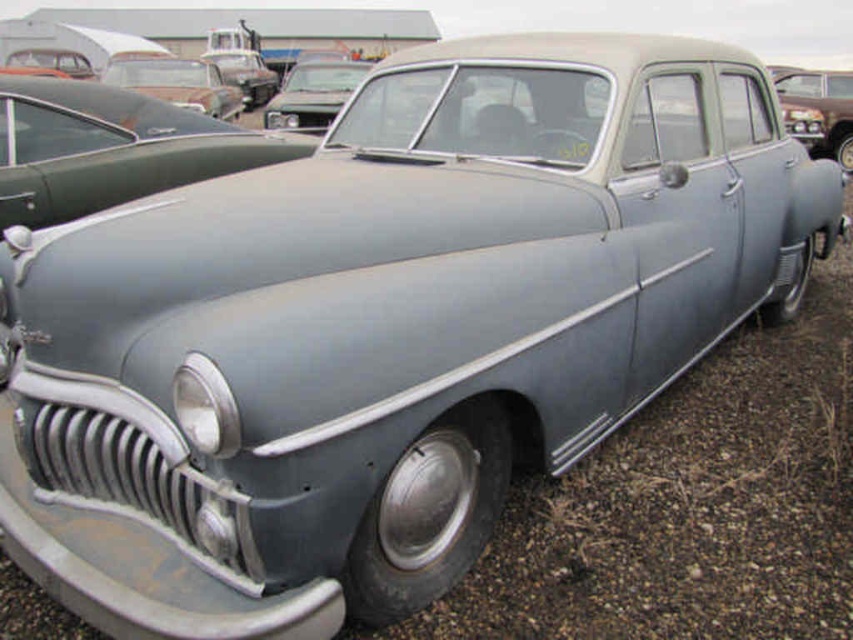
Who is taller, matte gray car at center or rusty metal car at upper left?

rusty metal car at upper left

Is matte gray car at center wider than rusty metal car at upper left?

No.

The width and height of the screenshot is (853, 640). Describe the element at coordinates (109, 147) in the screenshot. I see `matte gray car at center` at that location.

Find the location of a particular element. The height and width of the screenshot is (640, 853). matte gray car at center is located at coordinates (109, 147).

Is matte gray car at center above matte gray car at upper right?

Actually, matte gray car at center is below matte gray car at upper right.

Does matte gray car at center have a greater width compared to matte gray car at upper right?

No.

In order to click on matte gray car at center in this screenshot , I will do `click(109, 147)`.

Image resolution: width=853 pixels, height=640 pixels. What do you see at coordinates (817, 112) in the screenshot?
I see `matte gray car at upper right` at bounding box center [817, 112].

Is matte gray car at upper right wider than rusty metal car at upper left?

Incorrect, matte gray car at upper right's width does not surpass rusty metal car at upper left's.

Is point (822, 106) closer to camera compared to point (190, 86)?

No, it is behind (190, 86).

Where is `matte gray car at upper right`? This screenshot has width=853, height=640. matte gray car at upper right is located at coordinates (817, 112).